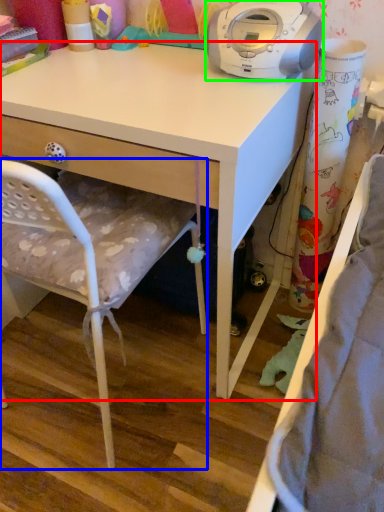
Question: Based on their relative distances, which object is farther from desk (highlighted by a red box)? Choose from chair (highlighted by a blue box) and home appliance (highlighted by a green box).

Choices:
 (A) chair
 (B) home appliance

Answer: (B)